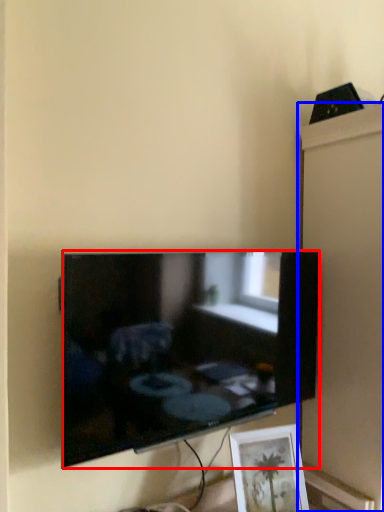
Question: Which point is closer to the camera, television (highlighted by a red box) or cabinet (highlighted by a blue box)?

Choices:
 (A) television
 (B) cabinet

Answer: (A)